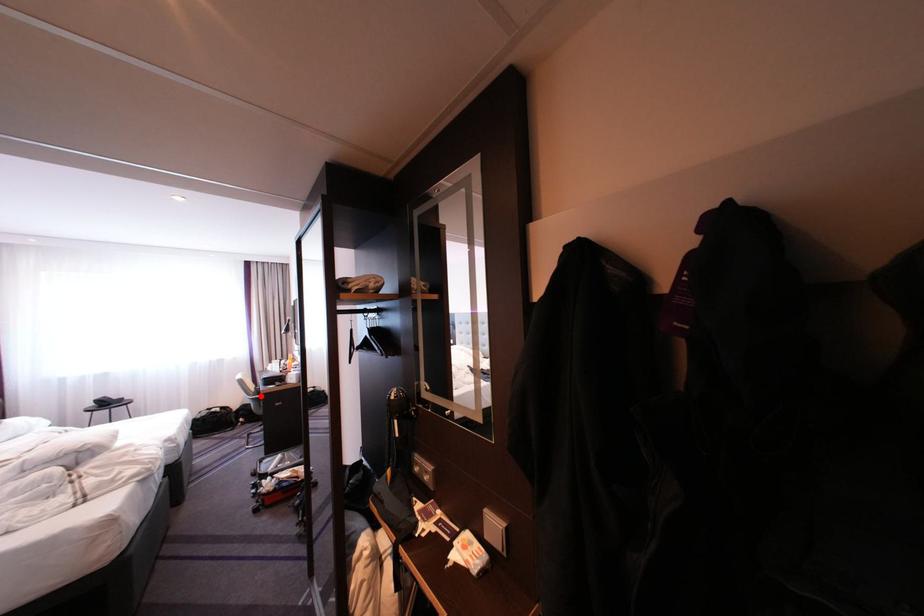
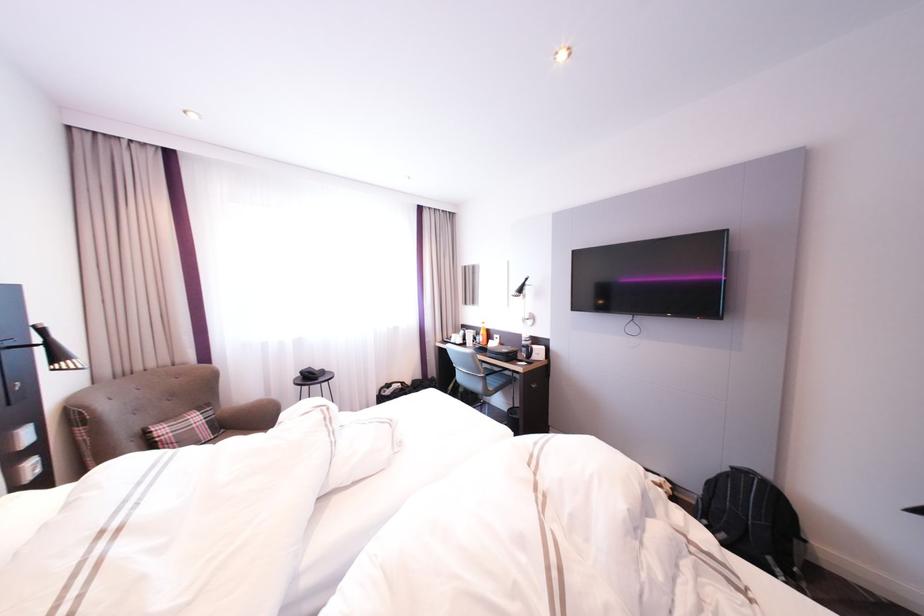
Locate, in the second image, the point that corresponds to the highlighted location in the first image.

(492, 373)